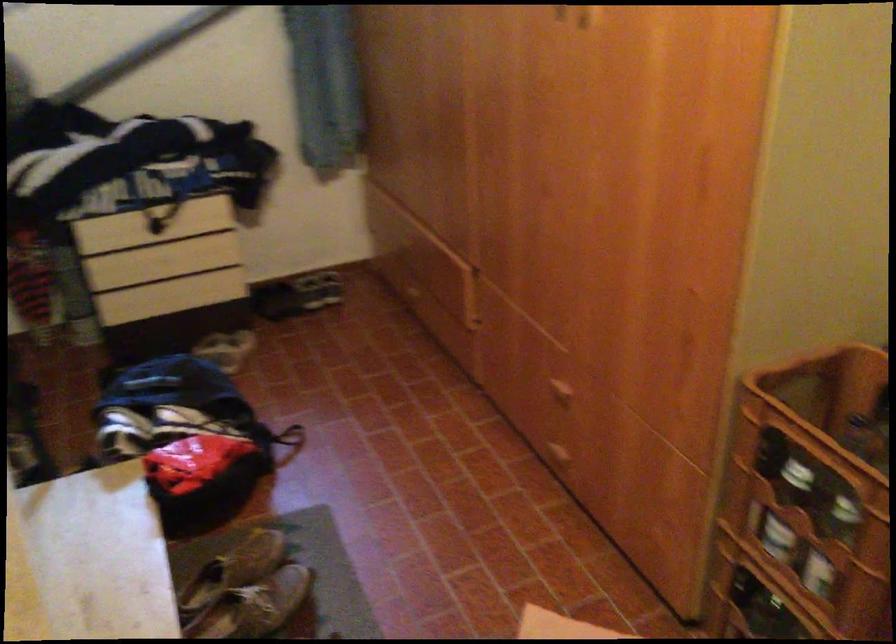
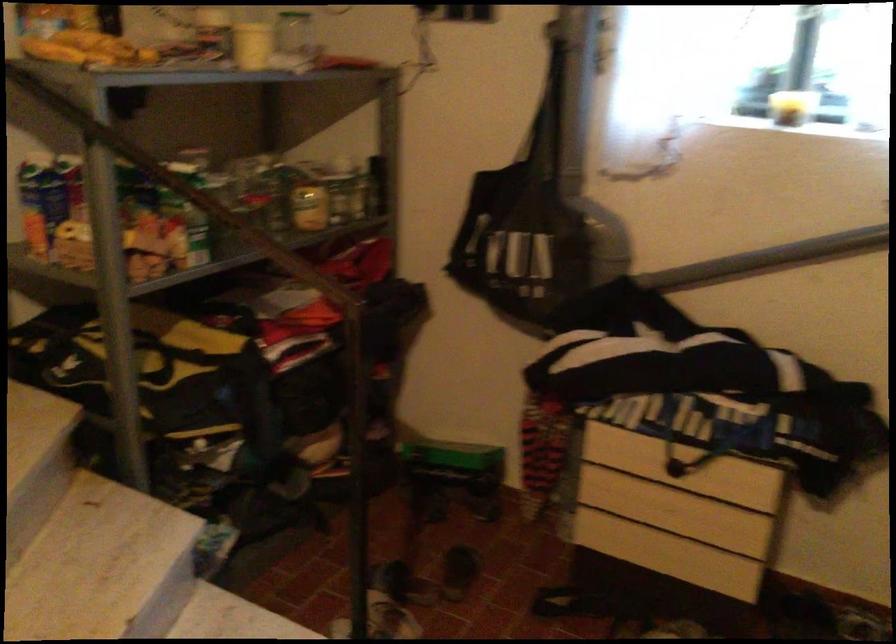
Find the pixel in the second image that matches point 147,223 in the first image.

(660, 456)